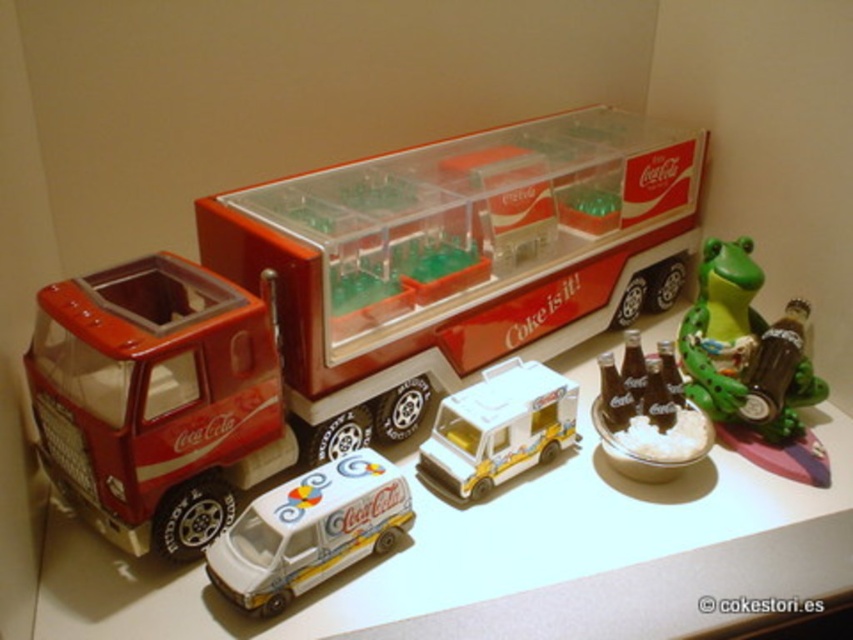
Question: Among these points, which one is nearest to the camera?

Choices:
 (A) (393, 497)
 (B) (376, 156)
 (C) (543, 492)

Answer: (A)

Question: Observing the image, what is the correct spatial positioning of white glossy table at center in reference to white glossy van at center?

Choices:
 (A) left
 (B) right

Answer: (B)

Question: Is white glossy table at center to the left of green rubber frog at right from the viewer's perspective?

Choices:
 (A) no
 (B) yes

Answer: (B)

Question: Which point appears farthest from the camera in this image?

Choices:
 (A) (550, 467)
 (B) (699, 365)

Answer: (B)

Question: Which object appears closest to the camera in this image?

Choices:
 (A) white glossy van at center
 (B) white glossy table at center
 (C) green rubber frog at right

Answer: (B)

Question: Can you confirm if white glossy table at center is positioned below white glossy van at center?

Choices:
 (A) no
 (B) yes

Answer: (A)